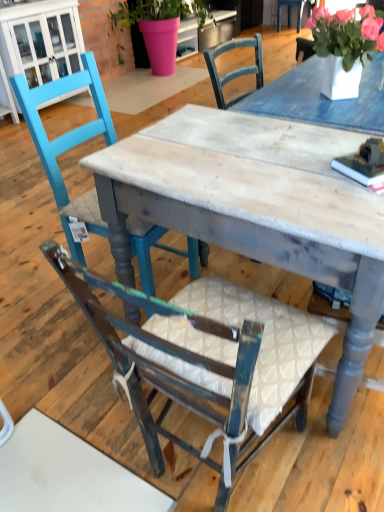
Question: Considering the positions of point (147, 320) and point (162, 5), is point (147, 320) closer or farther from the camera than point (162, 5)?

Choices:
 (A) farther
 (B) closer

Answer: (B)

Question: From the image's perspective, is wooden chair with white cushion at center, the 1th chair when ordered from front to back, located above or below pink matte pot at upper center?

Choices:
 (A) below
 (B) above

Answer: (A)

Question: Which object is positioned farthest from the wooden chair with white cushion at center, the 1th chair when ordered from front to back?

Choices:
 (A) distressed wood table at center
 (B) pink matte pot at upper center
 (C) white ceramic vase at upper right
 (D) teal painted wood chair at left, the 2th chair when ordered from front to back

Answer: (B)

Question: Considering the real-world distances, which object is closest to the distressed wood table at center?

Choices:
 (A) pink matte pot at upper center
 (B) wooden chair with white cushion at center, the 1th chair when ordered from front to back
 (C) teal painted wood chair at left, the 2th chair when ordered from front to back
 (D) white ceramic vase at upper right

Answer: (B)